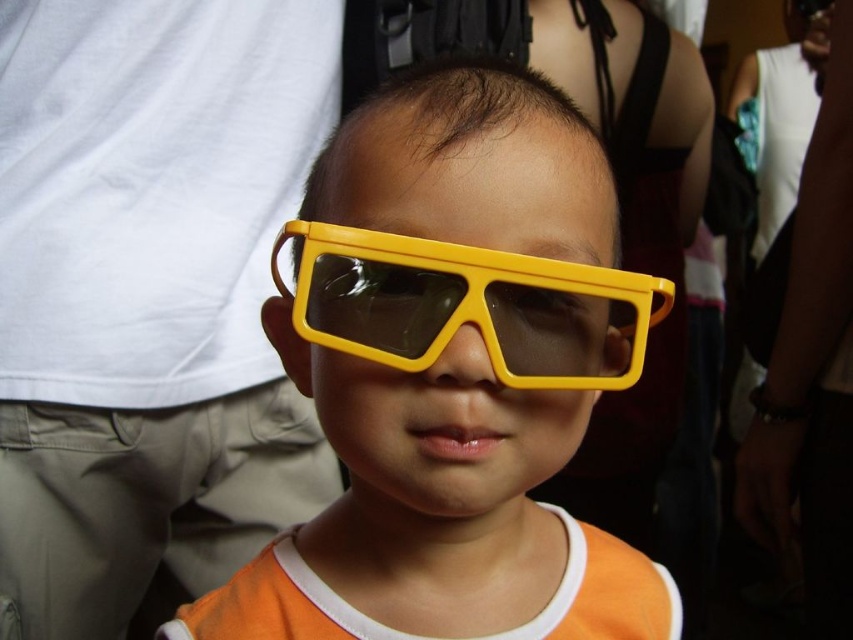
You are a photographer trying to capture a clear photo of the yellow plastic glasses at center and the yellow plastic goggles at center. Which object should you focus on first to ensure both are in focus?

The yellow plastic glasses at center is closer to the viewer than the yellow plastic goggles at center, so focus on the yellow plastic glasses at center first to ensure both are in focus.